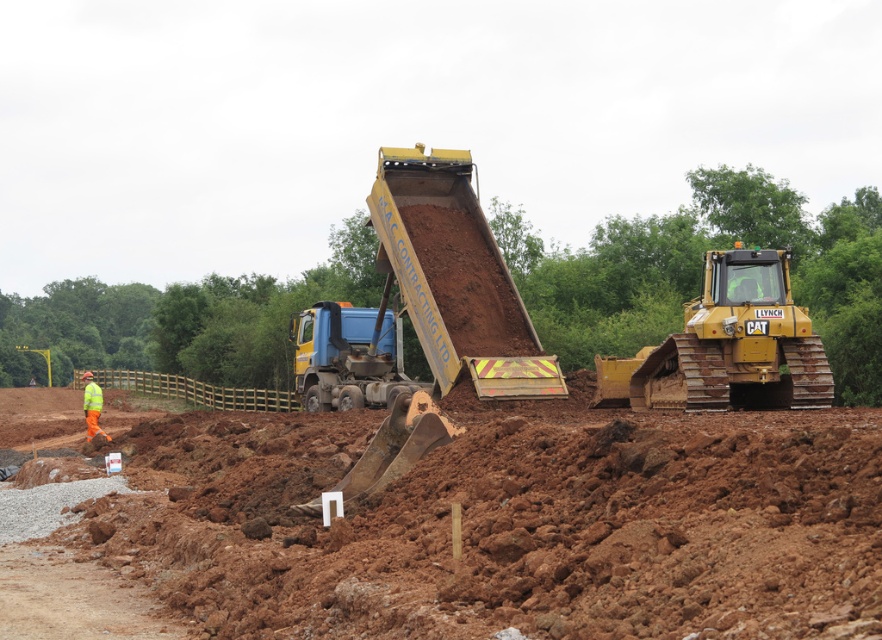
The image size is (882, 640). I want to click on metallic yellow tractor at center, so click(425, 317).

Is point (442, 202) closer to camera compared to point (87, 413)?

Yes, it is.

Where is `metallic yellow tractor at center`? The width and height of the screenshot is (882, 640). metallic yellow tractor at center is located at coordinates (425, 317).

Where is `metallic yellow tractor at center`? metallic yellow tractor at center is located at coordinates (x=425, y=317).

Can you confirm if brown earth at center is bigger than metallic yellow tractor at center?

Yes, brown earth at center is bigger than metallic yellow tractor at center.

Consider the image. Can you confirm if brown earth at center is positioned to the left of metallic yellow tractor at center?

Correct, you'll find brown earth at center to the left of metallic yellow tractor at center.

Is point (699, 476) more distant than point (484, 241)?

No, (699, 476) is in front of (484, 241).

In order to click on brown earth at center in this screenshot , I will do `click(507, 525)`.

Is yellow metallic tractor at center to the right of hi-viz reflective vest at lower left from the viewer's perspective?

Correct, you'll find yellow metallic tractor at center to the right of hi-viz reflective vest at lower left.

Is yellow metallic tractor at center positioned behind hi-viz reflective vest at lower left?

No, it is not.

Is point (781, 312) more distant than point (101, 394)?

No, (781, 312) is closer to viewer.

Identify the location of yellow metallic tractor at center. Image resolution: width=882 pixels, height=640 pixels. [727, 346].